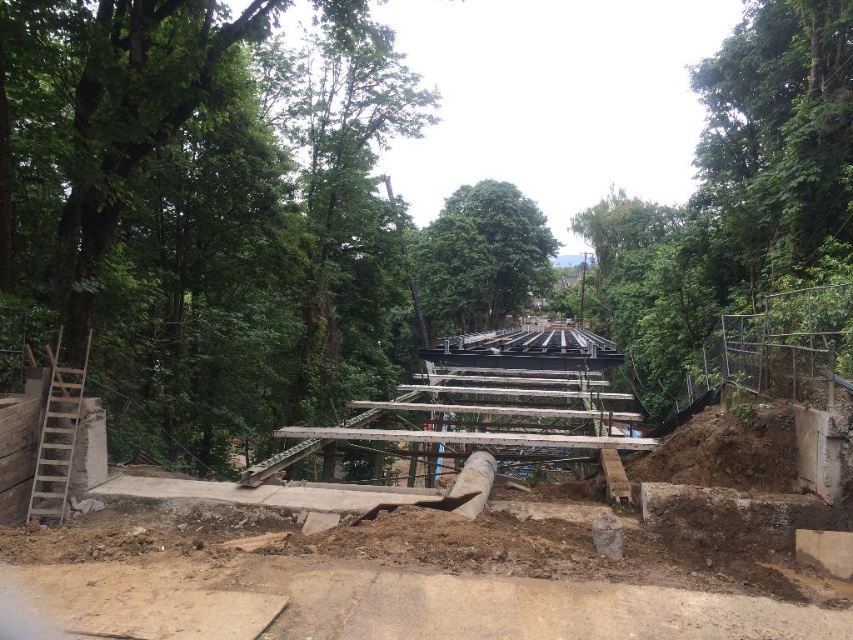
Question: Is concrete stairs at center in front of green leafy tree at center?

Choices:
 (A) no
 (B) yes

Answer: (B)

Question: Which of the following is the farthest from the observer?

Choices:
 (A) green leafy tree at upper right
 (B) brown dirt track at lower left
 (C) green leafy tree at center
 (D) concrete stairs at center

Answer: (C)

Question: Is brown dirt track at lower left further to camera compared to green leafy tree at upper right?

Choices:
 (A) yes
 (B) no

Answer: (B)

Question: Which of the following is the closest to the observer?

Choices:
 (A) green leafy tree at upper right
 (B) concrete stairs at center
 (C) green leafy tree at center

Answer: (B)

Question: Which point is farther to the camera?

Choices:
 (A) (144, 490)
 (B) (390, 536)

Answer: (A)

Question: Is green leafy tree at upper right thinner than green leafy tree at center?

Choices:
 (A) no
 (B) yes

Answer: (A)